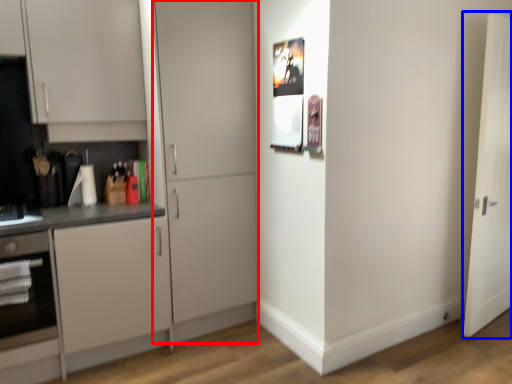
Question: Among these objects, which one is farthest to the camera, door (highlighted by a red box) or door (highlighted by a blue box)?

Choices:
 (A) door
 (B) door

Answer: (B)